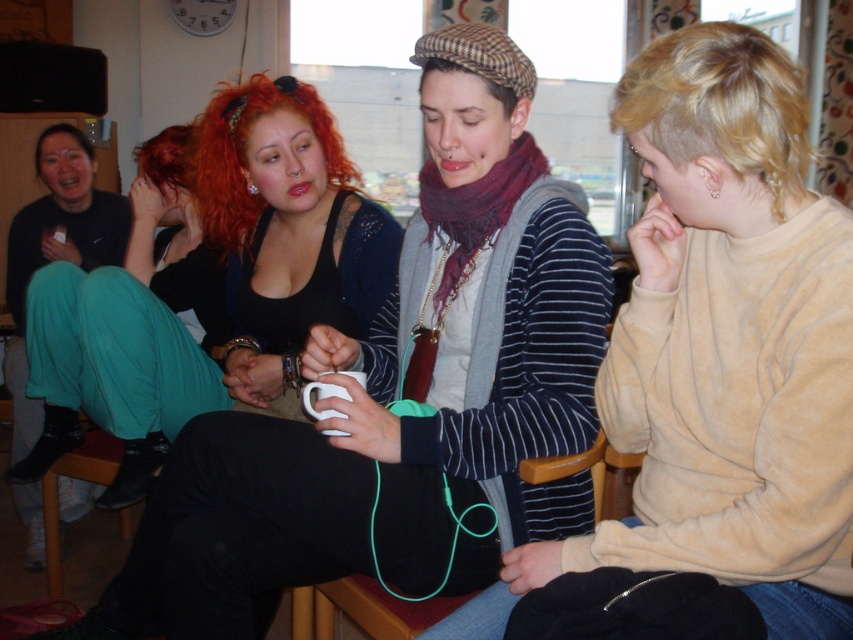
Is matte black tank top at center to the left of striped sweater at center from the viewer's perspective?

Correct, you'll find matte black tank top at center to the left of striped sweater at center.

Which is in front, point (347, 378) or point (717, 506)?

Positioned in front is point (717, 506).

This screenshot has width=853, height=640. I want to click on matte black tank top at center, so click(x=402, y=394).

Where is `matte black tank top at center`? The image size is (853, 640). matte black tank top at center is located at coordinates (402, 394).